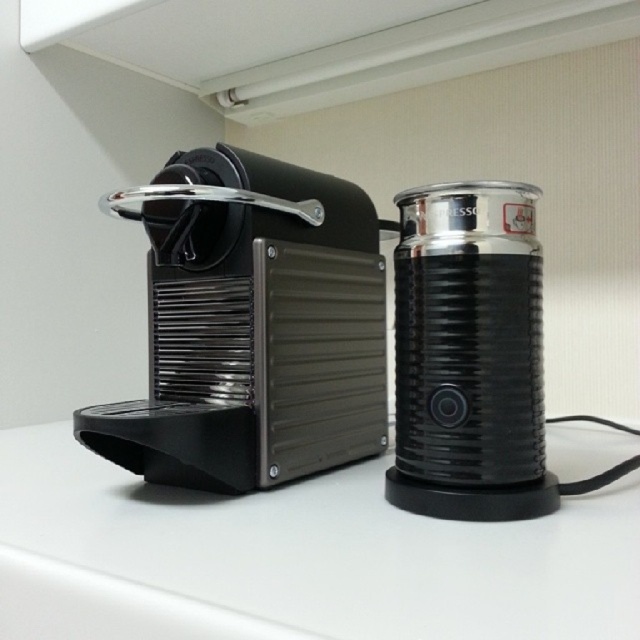
Question: Does white matte counter at center appear on the left side of matte black coffee machine at left?

Choices:
 (A) yes
 (B) no

Answer: (A)

Question: Among these objects, which one is nearest to the camera?

Choices:
 (A) matte black coffee machine at left
 (B) white matte counter at center
 (C) black textured milk frother at right

Answer: (B)

Question: Estimate the real-world distances between objects in this image. Which object is closer to the black textured milk frother at right?

Choices:
 (A) matte black coffee machine at left
 (B) white matte counter at center

Answer: (B)

Question: Is matte black coffee machine at left smaller than black textured milk frother at right?

Choices:
 (A) no
 (B) yes

Answer: (A)

Question: Does white matte counter at center have a greater width compared to black textured milk frother at right?

Choices:
 (A) no
 (B) yes

Answer: (B)

Question: Estimate the real-world distances between objects in this image. Which object is farther from the black textured milk frother at right?

Choices:
 (A) matte black coffee machine at left
 (B) white matte counter at center

Answer: (A)